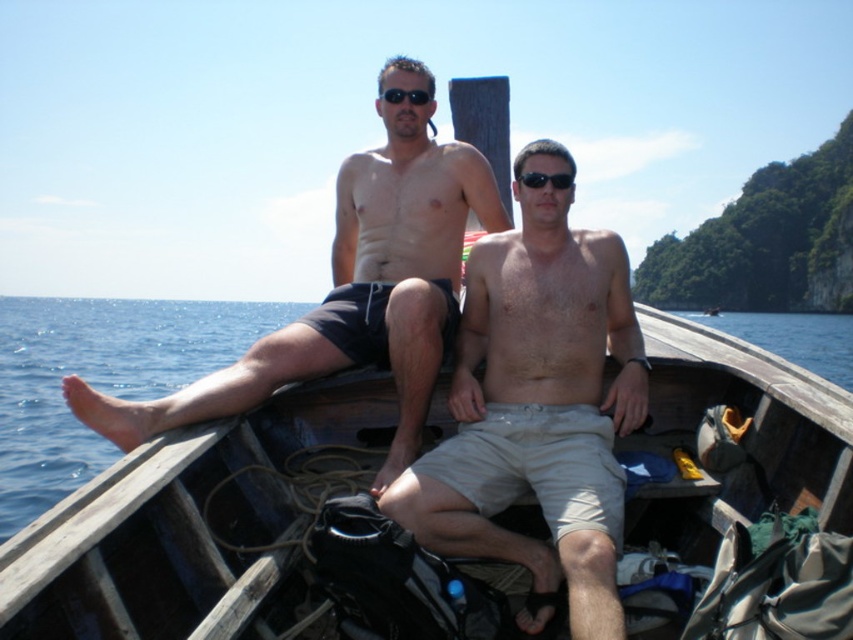
You are a photographer standing on the shore and want to take a photo of the wooden boat at center and the black matte sunglasses at center. Based on their positions, which object will appear closer to the camera in the photo?

The wooden boat at center will appear closer to the camera in the photo because it is in front of the black matte sunglasses at center according to their spatial arrangement.

You are a photographer trying to capture both the wooden boat at center and the light beige shorts at center in a single frame. Based on their sizes, which object should you focus on first to ensure both are in the frame?

The wooden boat at center is shorter than light beige shorts at center, so you should focus on the wooden boat at center first to ensure both are in the frame.